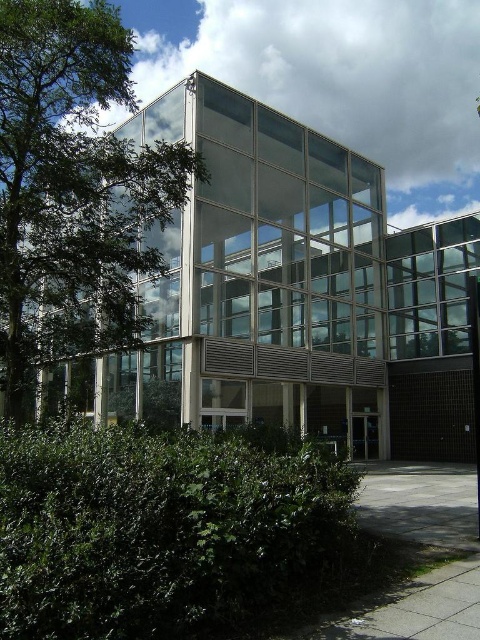
Question: Where is green leafy bush at lower left located in relation to green leafy tree at left in the image?

Choices:
 (A) right
 (B) left

Answer: (A)

Question: Does green leafy bush at lower left come in front of green leafy tree at left?

Choices:
 (A) yes
 (B) no

Answer: (A)

Question: Does green leafy bush at lower left come behind green leafy tree at left?

Choices:
 (A) no
 (B) yes

Answer: (A)